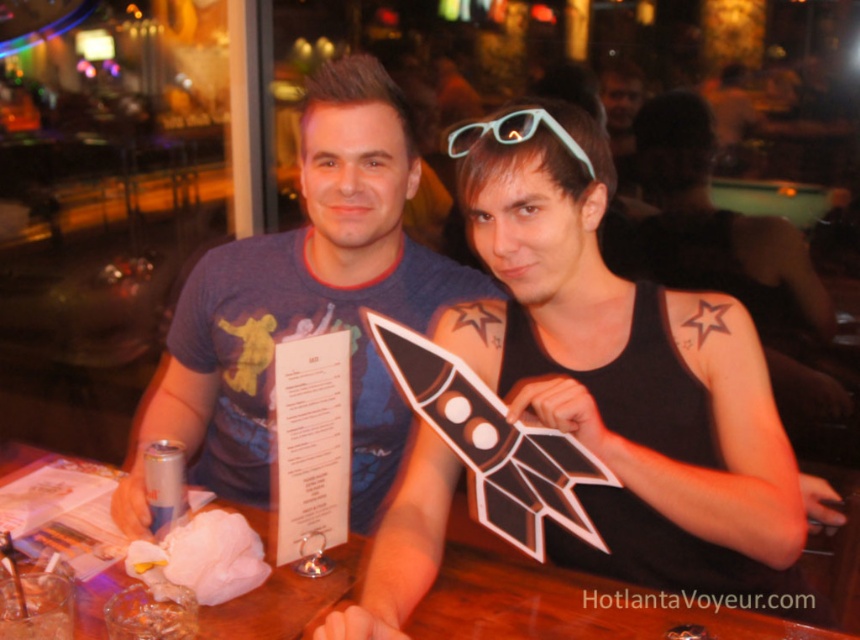
Question: Is matte blue t-shirt at center smaller than translucent plastic glasses at center?

Choices:
 (A) yes
 (B) no

Answer: (B)

Question: Which point is farther from the camera taking this photo?

Choices:
 (A) (561, 636)
 (B) (502, 145)

Answer: (B)

Question: Does blue cotton t-shirt at center lie behind wooden table at center?

Choices:
 (A) yes
 (B) no

Answer: (A)

Question: Is matte blue t-shirt at center positioned before translucent plastic glasses at center?

Choices:
 (A) no
 (B) yes

Answer: (B)

Question: Considering the real-world distances, which object is closest to the matte blue t-shirt at center?

Choices:
 (A) blue cotton t-shirt at center
 (B) translucent plastic glasses at center
 (C) wooden table at center

Answer: (C)

Question: Which object is closer to the camera taking this photo?

Choices:
 (A) blue cotton t-shirt at center
 (B) wooden table at center

Answer: (B)